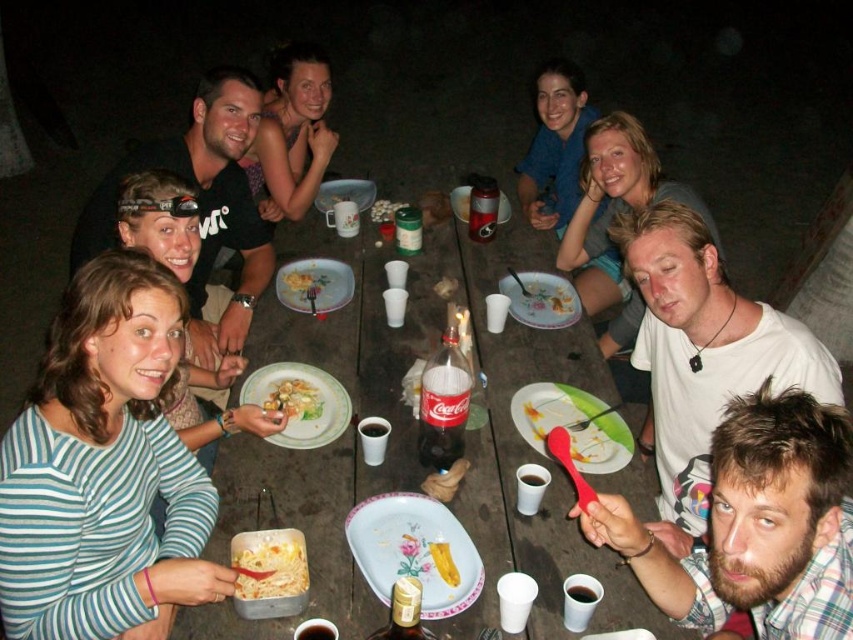
Question: Which point appears closest to the camera in this image?

Choices:
 (A) 502,205
 (B) 318,176
 (C) 302,404

Answer: (C)

Question: Which of the following is the farthest from the observer?

Choices:
 (A) porcelain plate at center
 (B) white matte man at center
 (C) bearded plaid shirt at lower right

Answer: (A)

Question: Can you confirm if smooth skin face at upper center is wider than golden crispy fries at center?

Choices:
 (A) no
 (B) yes

Answer: (B)

Question: Does white matte shirt at upper right have a smaller size compared to yellowish matte bread at center?

Choices:
 (A) yes
 (B) no

Answer: (B)

Question: Which of the following is the farthest from the observer?

Choices:
 (A) (289, 305)
 (B) (276, 196)
 (C) (321, 566)
 (D) (462, 200)

Answer: (B)

Question: Is matte blue shirt at upper center further to the viewer compared to plastic red spatula at center?

Choices:
 (A) yes
 (B) no

Answer: (A)